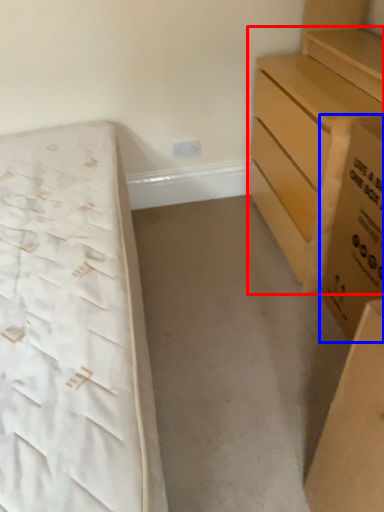
Question: Which of the following is the farthest to the observer, chest of drawers (highlighted by a red box) or cardboard box (highlighted by a blue box)?

Choices:
 (A) chest of drawers
 (B) cardboard box

Answer: (A)